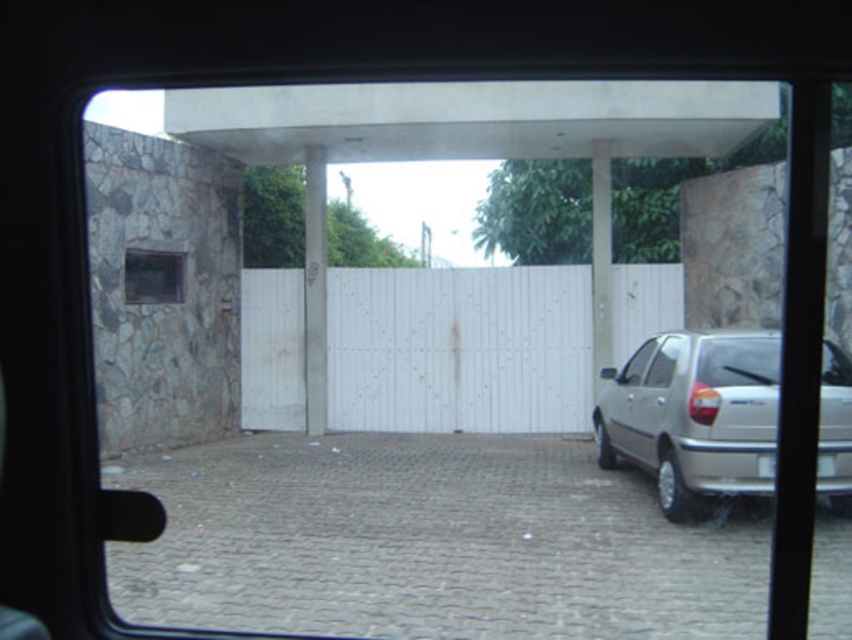
Question: Which of the following is the closest to the observer?

Choices:
 (A) transparent glass window at right
 (B) white plastic license plate at lower right
 (C) silver metallic car at right

Answer: (B)

Question: Can you confirm if white smooth pillar at center is wider than transparent glass window at right?

Choices:
 (A) yes
 (B) no

Answer: (A)

Question: Which point appears farthest from the camera in this image?

Choices:
 (A) (597, 593)
 (B) (369, 365)
 (C) (591, 314)

Answer: (B)

Question: Is gray cobblestone driveway at center above silver metallic car at right?

Choices:
 (A) yes
 (B) no

Answer: (B)

Question: Where is white smooth pole at center located in relation to transparent glass window at upper left in the image?

Choices:
 (A) right
 (B) left

Answer: (A)

Question: Based on their relative distances, which object is farther from the white smooth pillar at center?

Choices:
 (A) silver metallic car at right
 (B) white plastic license plate at lower right

Answer: (B)